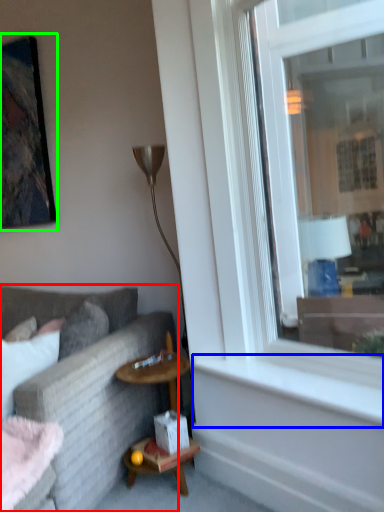
Question: Based on their relative distances, which object is farther from studio couch (highlighted by a red box)? Choose from window sill (highlighted by a blue box) and picture frame (highlighted by a green box).

Choices:
 (A) window sill
 (B) picture frame

Answer: (B)